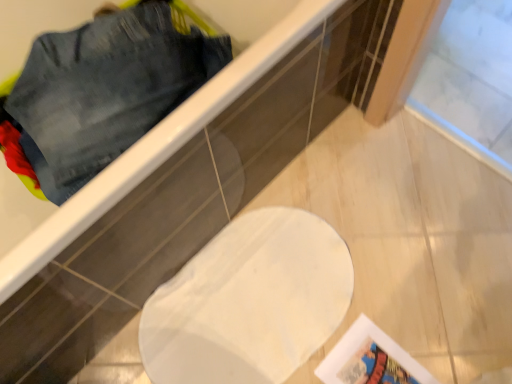
Identify the location of denim at upper left. Image resolution: width=512 pixels, height=384 pixels. (105, 91).

The image size is (512, 384). What do you see at coordinates (105, 91) in the screenshot?
I see `denim at upper left` at bounding box center [105, 91].

At what (x,y) coordinates should I click in order to perform the action: click on denim at upper left. Please return your answer as a coordinate pair (x, y). Looking at the image, I should click on (105, 91).